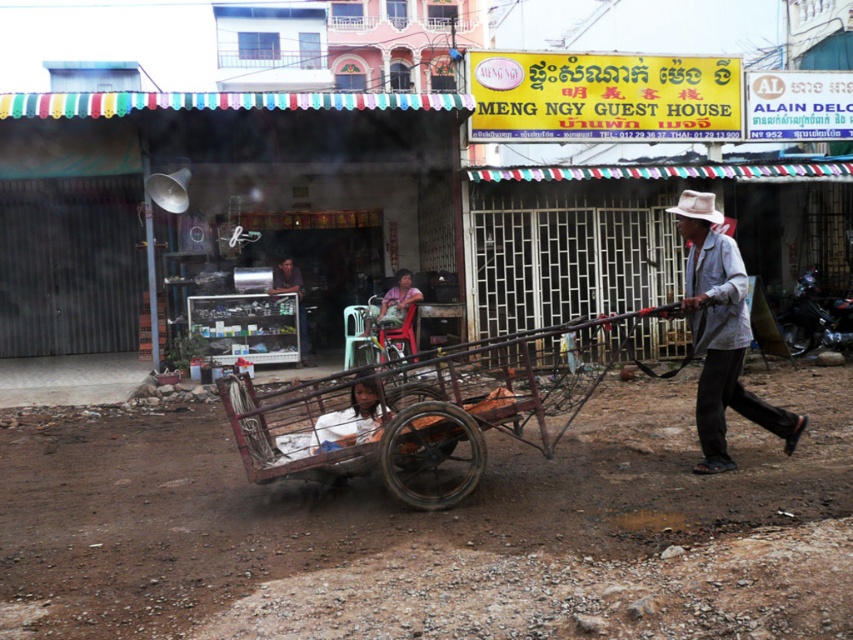
You are a town planner analyzing the layout of this street. The brown dirt field at lower center and the metallic grill at center are both important elements. Which of these two occupies a smaller area in the image?

The brown dirt field at lower center occupies less space than the metallic grill at center, so the brown dirt field at lower center is the smaller one.